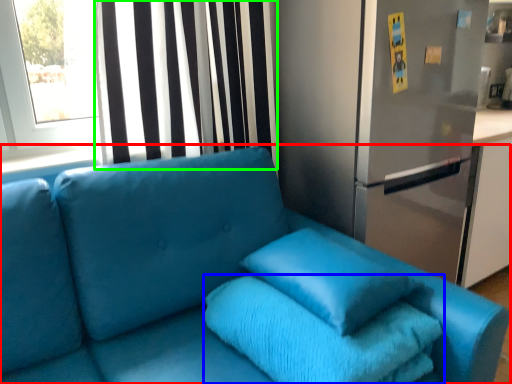
Question: Considering the real-world distances, which object is farthest from studio couch (highlighted by a red box)? bath towel (highlighted by a blue box) or curtain (highlighted by a green box)?

Choices:
 (A) bath towel
 (B) curtain

Answer: (B)